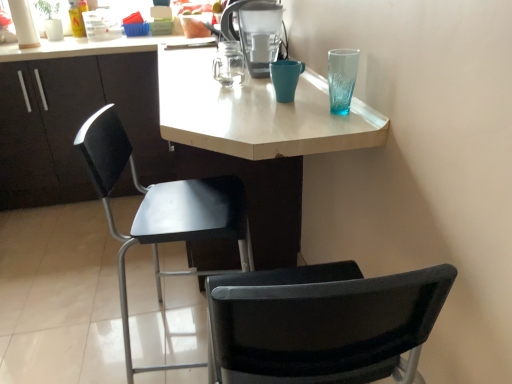
Question: From the image's perspective, relative to matte plastic water filter at upper center, is black plastic chair at center above or below?

Choices:
 (A) below
 (B) above

Answer: (A)

Question: Considering the relative positions of black plastic chair at center and matte plastic water filter at upper center in the image provided, is black plastic chair at center to the left or to the right of matte plastic water filter at upper center?

Choices:
 (A) left
 (B) right

Answer: (A)

Question: Which object is positioned closest to the white matte desk at center?

Choices:
 (A) teal ceramic mug at upper center
 (B) matte black cabinet at left
 (C) black plastic chair at center
 (D) matte plastic water filter at upper center

Answer: (C)

Question: Which is farther from the matte plastic water filter at upper center?

Choices:
 (A) teal ceramic mug at upper center
 (B) matte black cabinet at left
 (C) white matte desk at center
 (D) black plastic chair at center

Answer: (B)